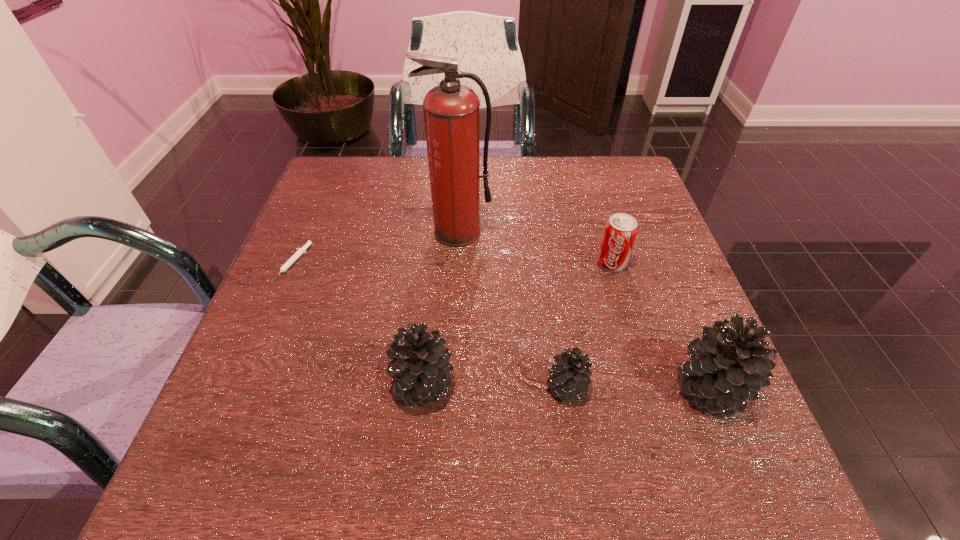
Locate an element on the screen. the leftmost pinecone is located at coordinates (420, 361).

You are a GUI agent. You are given a task and a screenshot of the screen. Output one action in this format:
    pyautogui.click(x=<x>, y=<y>)
    Task: Click on the fourth shortest object
    This screenshot has height=540, width=960.
    Given the screenshot: What is the action you would take?
    pyautogui.click(x=420, y=361)

I want to click on the fifth tallest object, so click(571, 375).

The width and height of the screenshot is (960, 540). What are the coordinates of `the third object from right to left` in the screenshot? It's located at [x=571, y=375].

Image resolution: width=960 pixels, height=540 pixels. I want to click on the rightmost pinecone, so click(x=729, y=365).

Image resolution: width=960 pixels, height=540 pixels. Identify the location of fire extinguisher. (451, 110).

Identify the location of the shortest object. (300, 251).

Where is `syringe`? Image resolution: width=960 pixels, height=540 pixels. syringe is located at coordinates (300, 251).

The width and height of the screenshot is (960, 540). I want to click on soda can, so click(x=620, y=231).

Where is `the third shortest object`? The image size is (960, 540). the third shortest object is located at coordinates (620, 231).